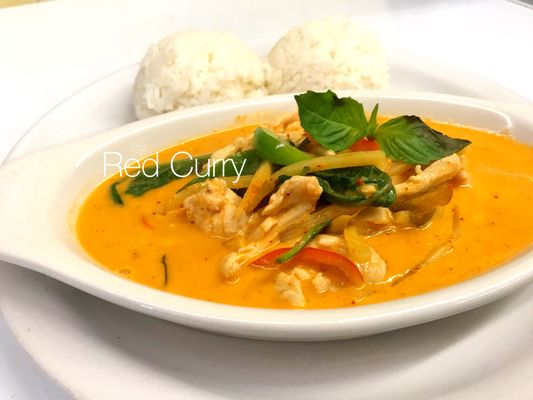
You are a GUI agent. You are given a task and a screenshot of the screen. Output one action in this format:
    pyautogui.click(x=<x>, y=<y>)
    Task: Click on the plate
    This screenshot has height=400, width=533.
    Given the screenshot: What is the action you would take?
    pyautogui.click(x=69, y=357)